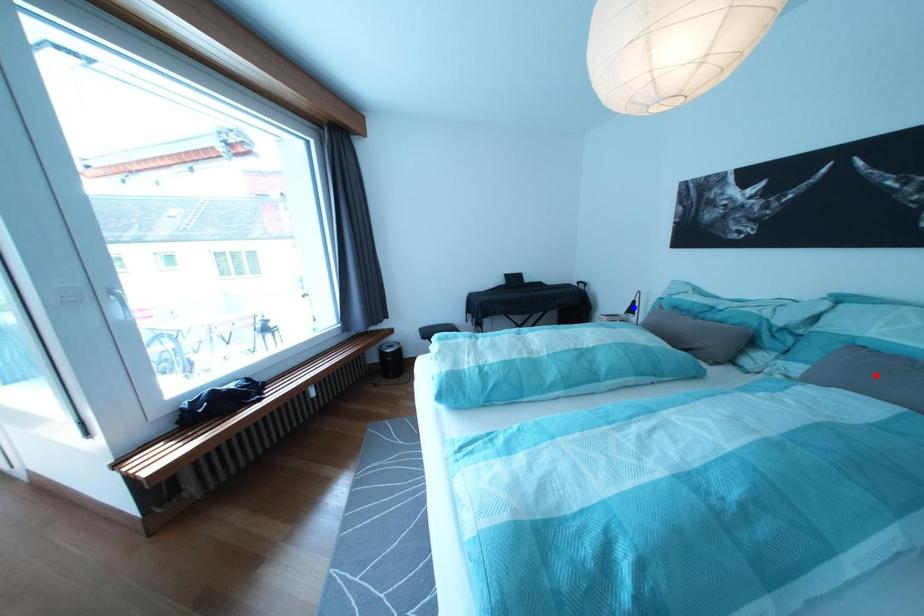
Question: Which of the two points in the image is closer to the camera?

Choices:
 (A) Blue point is closer.
 (B) Red point is closer.

Answer: (B)